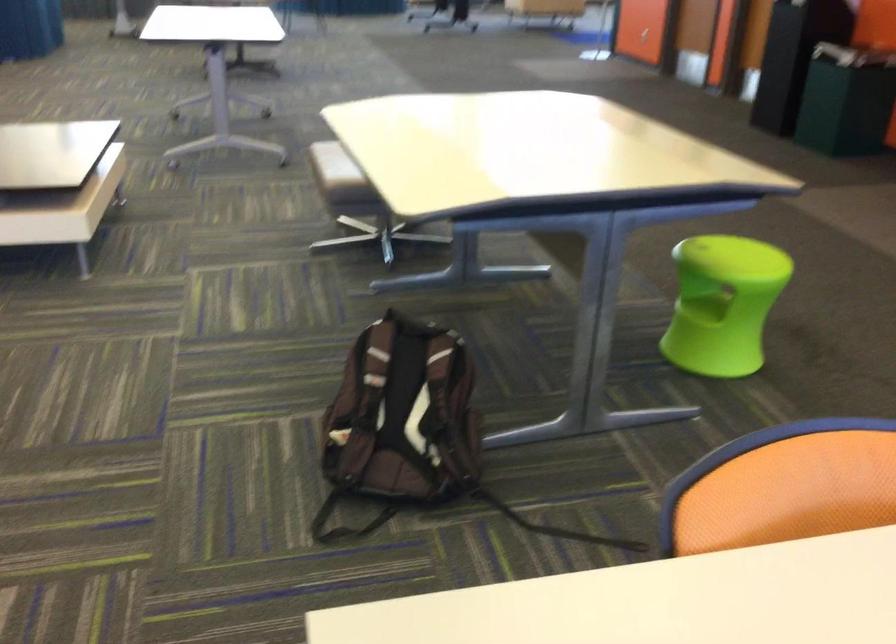
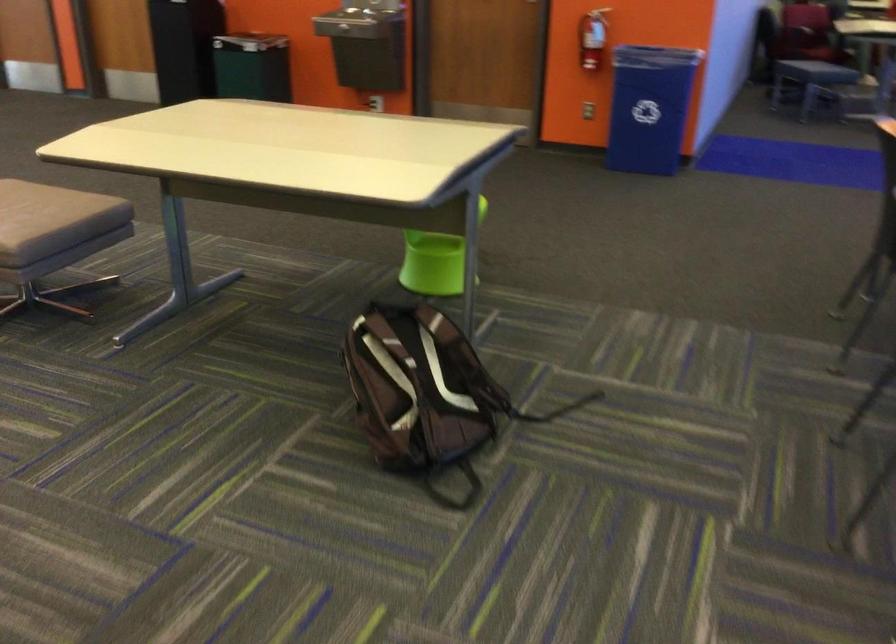
Question: I am providing you with two images of the same scene from different viewpoints. Please identify which objects are invisible in image2.

Choices:
 (A) water fountain button
 (B) chair sitting surface
 (C) green stool sitting surface
 (D) power outlet hub

Answer: (C)